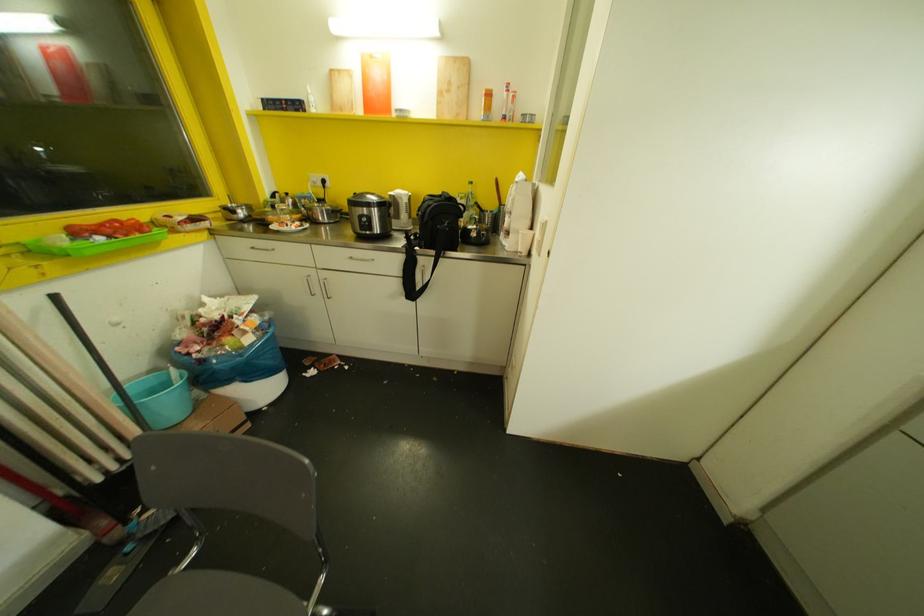
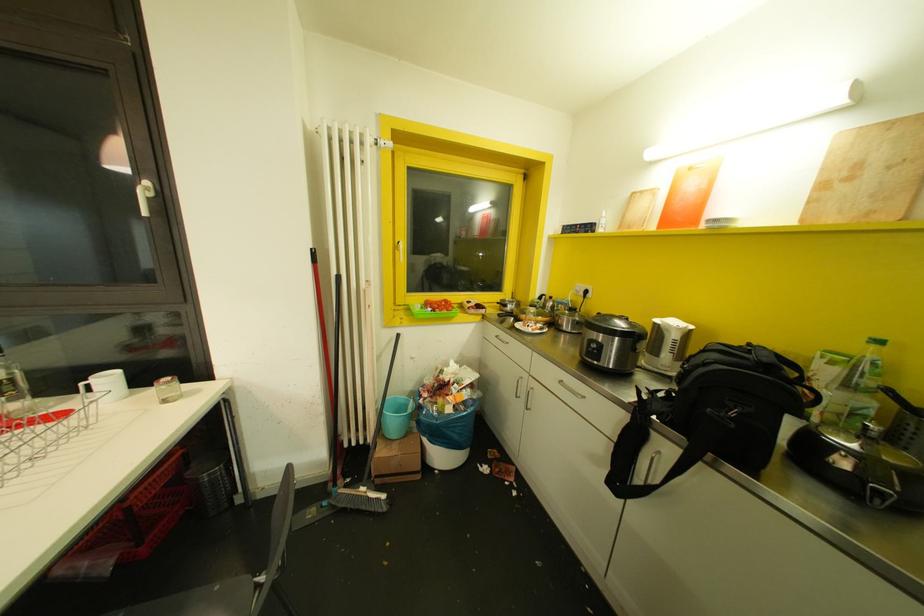
Question: Based on the continuous images, in which direction is the camera rotating? Reply with the corresponding letter.

Choices:
 (A) Left
 (B) Right
 (C) Up
 (D) Down

Answer: (A)